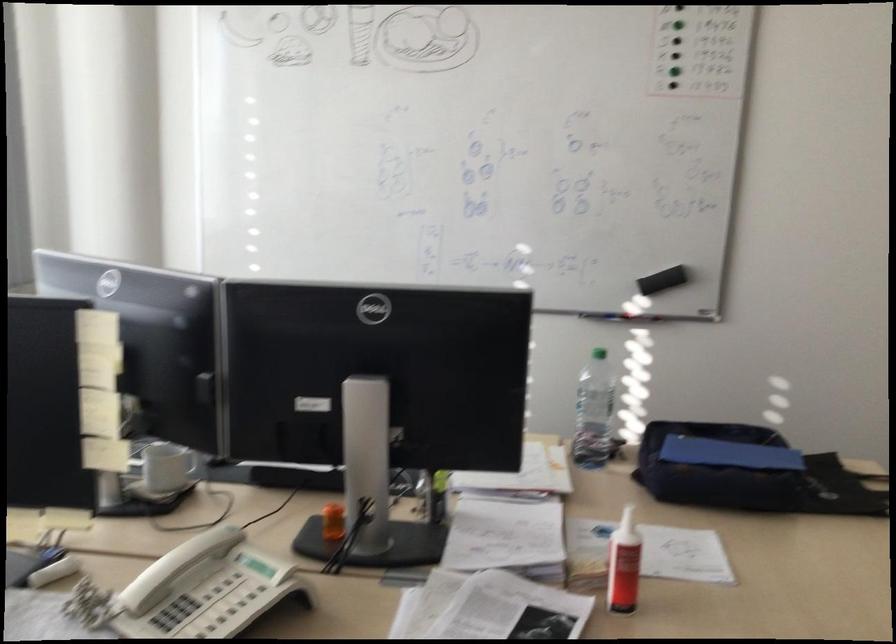
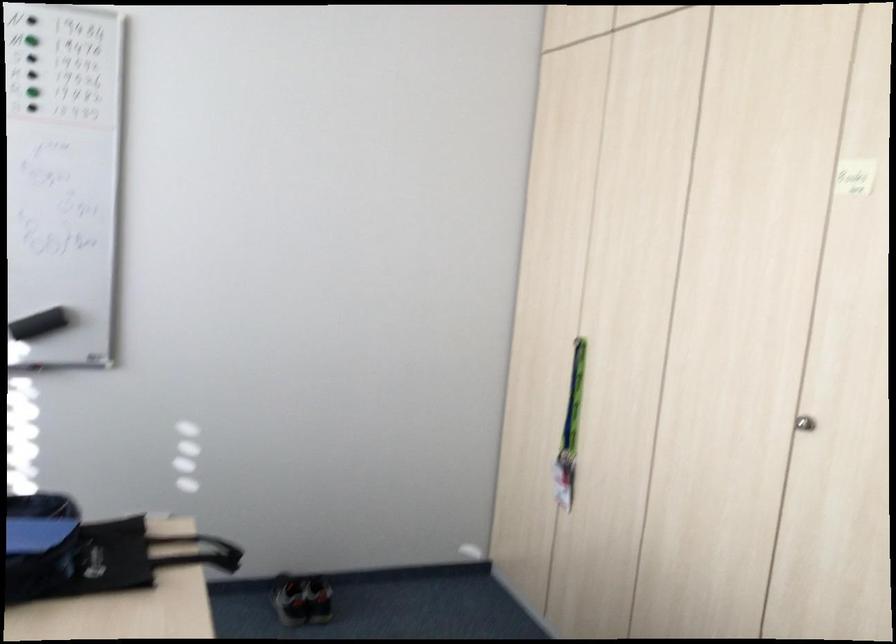
Locate, in the second image, the point that corresponds to (668,274) in the first image.

(39, 324)